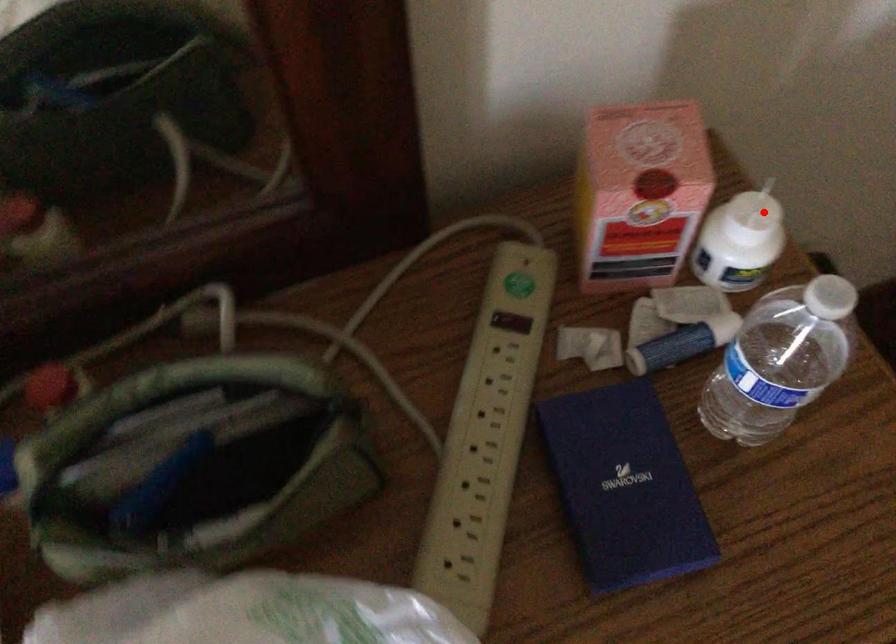
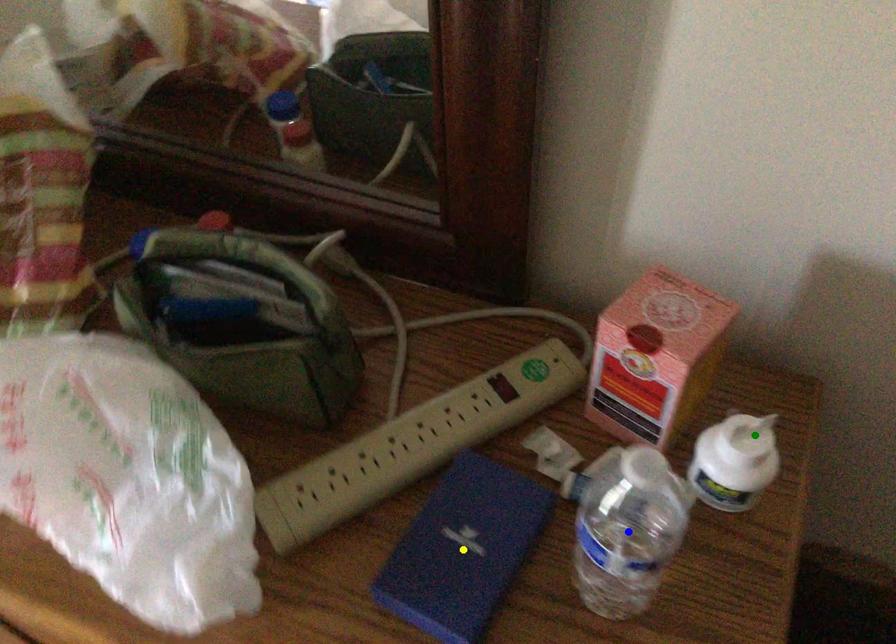
Question: I am providing you with two images of the same scene from different viewpoints. A red point is marked on the first image. You are given multiple points on the second image. Can you choose the point in image 2 that corresponds to the point in image 1?

Choices:
 (A) green point
 (B) yellow point
 (C) blue point

Answer: (A)